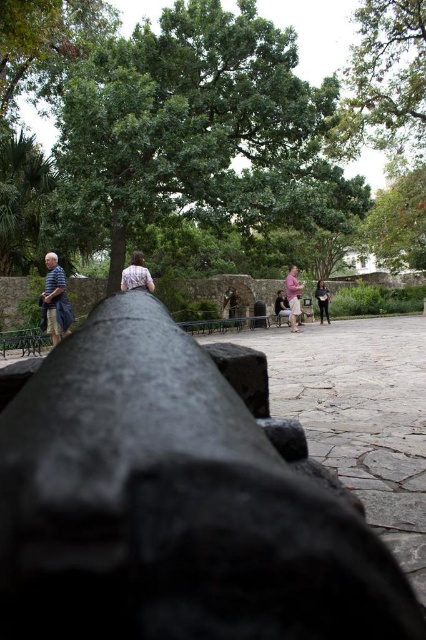
Which is in front, point (230, 288) or point (324, 301)?

Positioned in front is point (324, 301).

Who is shorter, light brown wooden bench at center or dark gray pants at center?

light brown wooden bench at center is shorter.

Identify the location of light brown wooden bench at center. (230, 304).

Where is `light brown wooden bench at center`? The width and height of the screenshot is (426, 640). light brown wooden bench at center is located at coordinates (230, 304).

Who is more distant from viewer, [66,332] or [316,301]?

The point [316,301] is behind.

Is dark blue shirt at left above dark gray pants at center?

No.

Where is `dark blue shirt at left`? dark blue shirt at left is located at coordinates (54, 300).

Does point (317, 524) come closer to viewer compared to point (282, 292)?

Yes, it is in front of point (282, 292).

Is black matte cannon at center taller than matte black jacket at center?

In fact, black matte cannon at center may be shorter than matte black jacket at center.

Does point (62, 502) lie in front of point (276, 316)?

Yes, point (62, 502) is closer to viewer.

The width and height of the screenshot is (426, 640). In order to click on black matte cannon at center in this screenshot , I will do [172, 506].